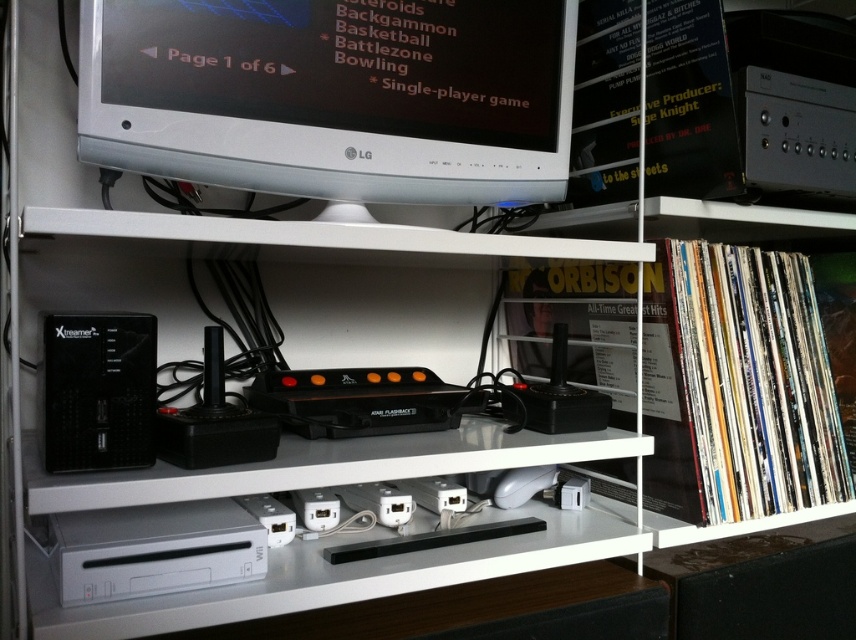
You are setting up a home entertainment system and need to place the white glossy computer monitor at upper center and the black plastic speaker at left on a shelf. Given that the shelf can only hold items up to the size of the speaker, will both items fit?

The white glossy computer monitor at upper center is larger in size than the black plastic speaker at left, so it will not fit on the shelf if the shelf can only accommodate items up to the speaker size. The speaker can fit, but the monitor cannot.

You are standing in front of the shelving unit and want to reach the point at coordinates point (141,132) and point (87,426). Which point is closer to you?

Point (87,426) is closer to you because it is in front of point (141,132).

You are setting up a home theater system and want to place the white glossy computer monitor at upper center and the black plastic speaker at left on a shelf. The shelf has a height limit of 18 inches. Which item might not fit based on their heights?

The white glossy computer monitor at upper center is taller than the black plastic speaker at left. If the monitor exceeds the 18 inch height limit, it might not fit on the shelf.